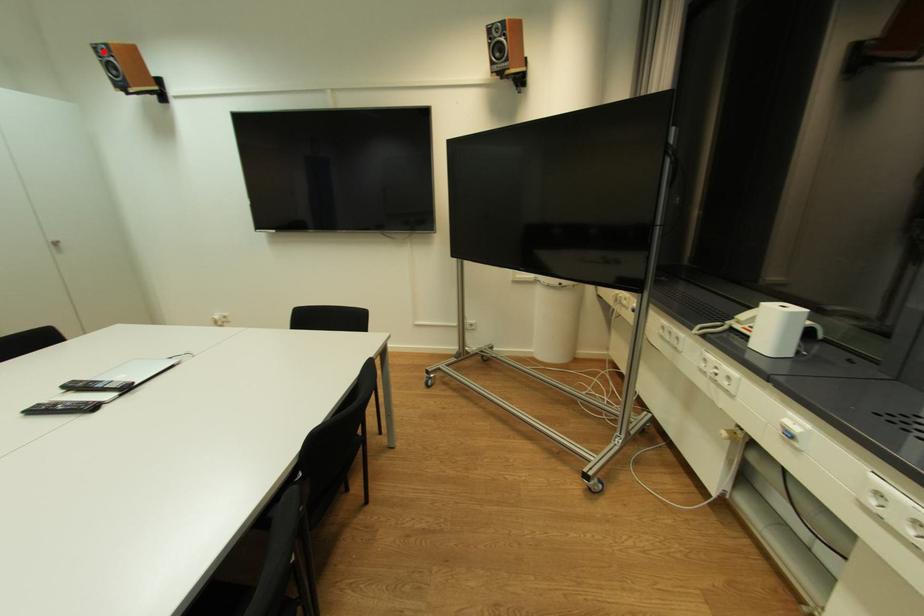
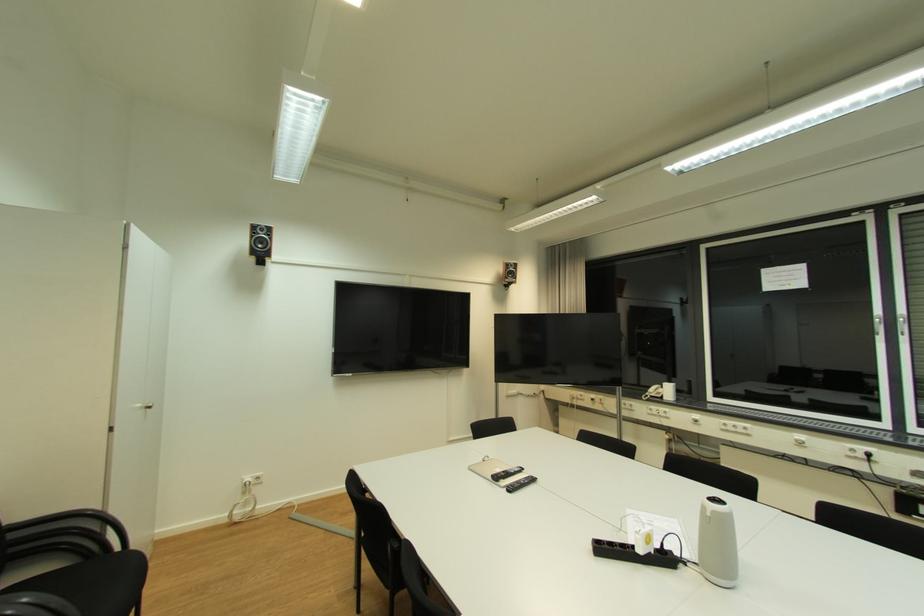
Question: I am providing you with two images of the same scene from different viewpoints. A red point is shown in image1. For the corresponding object point in image2, is it positioned nearer or farther from the camera?

Choices:
 (A) Nearer
 (B) Farther

Answer: (A)